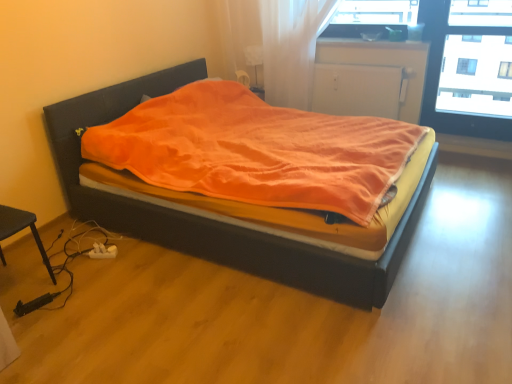
Question: Is smooth wood window sill at right further to the viewer compared to white matte radiator at upper center?

Choices:
 (A) no
 (B) yes

Answer: (B)

Question: From a real-world perspective, is smooth wood window sill at right positioned over white matte radiator at upper center based on gravity?

Choices:
 (A) no
 (B) yes

Answer: (A)

Question: From the image's perspective, would you say smooth wood window sill at right is shown under white matte radiator at upper center?

Choices:
 (A) yes
 (B) no

Answer: (A)

Question: Can you confirm if smooth wood window sill at right is positioned to the right of white matte radiator at upper center?

Choices:
 (A) yes
 (B) no

Answer: (A)

Question: Could you tell me if smooth wood window sill at right is turned towards white matte radiator at upper center?

Choices:
 (A) no
 (B) yes

Answer: (A)

Question: From a real-world perspective, is transparent glass window at upper right above or below smooth wood window sill at right?

Choices:
 (A) above
 (B) below

Answer: (A)

Question: From the image's perspective, is transparent glass window at upper right above or below smooth wood window sill at right?

Choices:
 (A) below
 (B) above

Answer: (B)

Question: Relative to smooth wood window sill at right, is transparent glass window at upper right in front or behind?

Choices:
 (A) behind
 (B) front

Answer: (B)

Question: Based on their sizes in the image, would you say transparent glass window at upper right is bigger or smaller than smooth wood window sill at right?

Choices:
 (A) small
 (B) big

Answer: (B)

Question: Looking at their shapes, would you say smooth wood window sill at right is wider or thinner than velvet orange blanket at center?

Choices:
 (A) wide
 (B) thin

Answer: (B)

Question: Relative to velvet orange blanket at center, is smooth wood window sill at right in front or behind?

Choices:
 (A) front
 (B) behind

Answer: (B)

Question: From a real-world perspective, is smooth wood window sill at right physically located above or below velvet orange blanket at center?

Choices:
 (A) below
 (B) above

Answer: (A)

Question: In terms of height, does smooth wood window sill at right look taller or shorter compared to velvet orange blanket at center?

Choices:
 (A) short
 (B) tall

Answer: (A)

Question: In terms of height, does white matte radiator at upper center look taller or shorter compared to transparent glass window at upper right?

Choices:
 (A) short
 (B) tall

Answer: (A)

Question: Is white matte radiator at upper center to the left or to the right of transparent glass window at upper right in the image?

Choices:
 (A) right
 (B) left

Answer: (B)